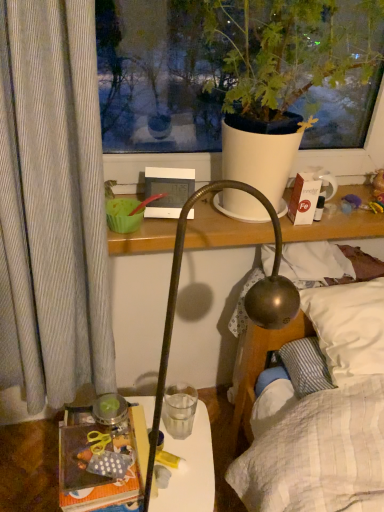
Identify the location of vacant space in front of transparent glass at center. (185, 460).